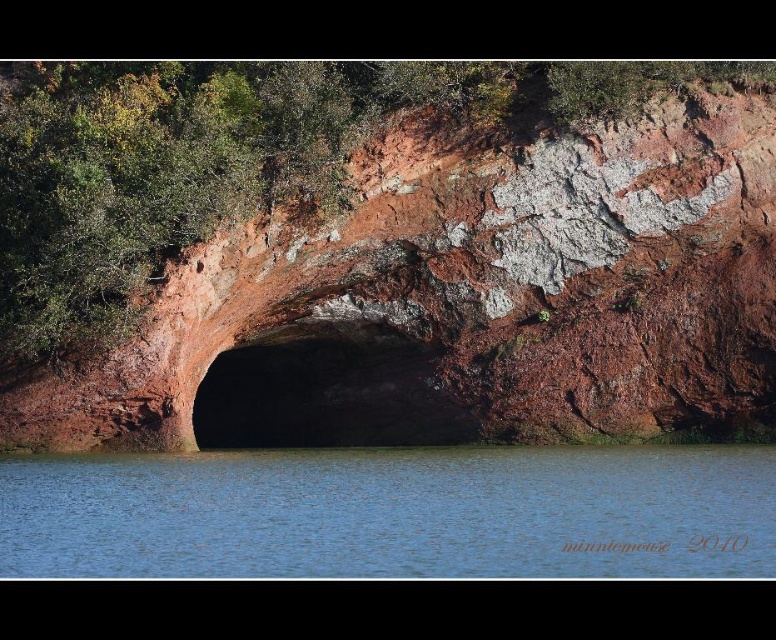
Does rusty rock cave at center appear over brown rough cave at center?

Correct, rusty rock cave at center is located above brown rough cave at center.

Between point (241, 269) and point (383, 339), which one is positioned in front?

Point (241, 269) is more forward.

Find the location of a particular element. Image resolution: width=776 pixels, height=640 pixels. rusty rock cave at center is located at coordinates (456, 280).

Is point (286, 499) closer to viewer compared to point (386, 314)?

Yes, it is in front of point (386, 314).

Who is positioned more to the left, blue water at center or brown rough cave at center?

brown rough cave at center is more to the left.

What do you see at coordinates (393, 513) in the screenshot?
I see `blue water at center` at bounding box center [393, 513].

Identify the location of blue water at center. (393, 513).

Is the position of rusty rock cave at center less distant than that of blue water at center?

No, it is not.

Can you confirm if rusty rock cave at center is smaller than blue water at center?

No.

You are a GUI agent. You are given a task and a screenshot of the screen. Output one action in this format:
    pyautogui.click(x=<x>, y=<y>)
    Task: Click on the rusty rock cave at center
    
    Given the screenshot: What is the action you would take?
    pyautogui.click(x=456, y=280)

The width and height of the screenshot is (776, 640). I want to click on rusty rock cave at center, so click(x=456, y=280).